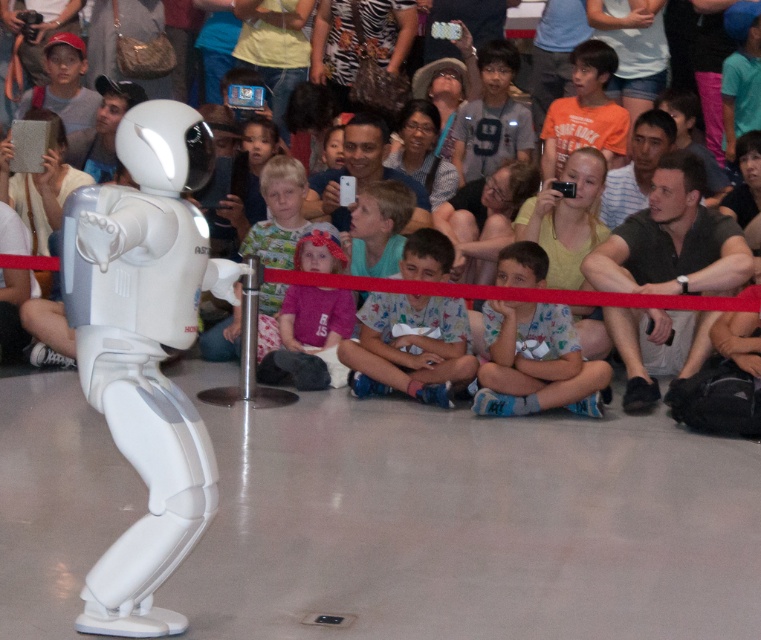
Question: Considering the real-world distances, which object is closest to the zebra-patterned dress at center?

Choices:
 (A) matte gray tablet at upper left
 (B) matte white phone at center
 (C) white plastic robot at center

Answer: (B)

Question: Is dark gray fabric shirt at right bigger than white plastic robot at center?

Choices:
 (A) no
 (B) yes

Answer: (B)

Question: Is dark gray fabric shirt at right bigger than matte gray tablet at upper left?

Choices:
 (A) no
 (B) yes

Answer: (B)

Question: Among these objects, which one is farthest from the camera?

Choices:
 (A) white matte helmet at center
 (B) matte white phone at center
 (C) gray matte shirt at center

Answer: (A)

Question: Considering the relative positions of dark gray fabric shirt at right and zebra-patterned dress at center in the image provided, where is dark gray fabric shirt at right located with respect to zebra-patterned dress at center?

Choices:
 (A) right
 (B) left

Answer: (A)

Question: Which point is closer to the camera?

Choices:
 (A) pos(320,29)
 (B) pos(734,220)

Answer: (B)